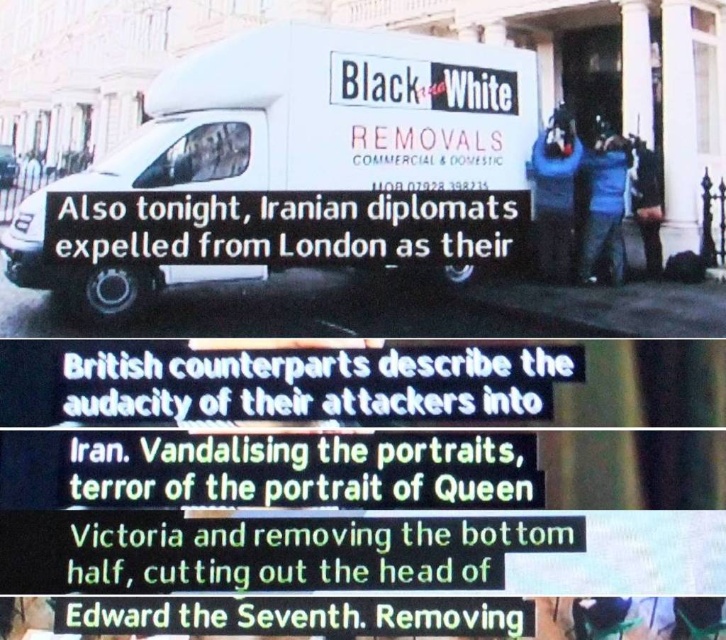
Is point (452, 74) behind point (600, 156)?

That is False.

Between point (486, 51) and point (582, 236), which one is positioned behind?

Positioned behind is point (486, 51).

Which is behind, point (224, 90) or point (600, 164)?

Positioned behind is point (600, 164).

Image resolution: width=726 pixels, height=640 pixels. I want to click on white matte van at center, so (x=295, y=138).

Can you confirm if blue fabric camera at upper right is taller than blue jeans at right?

Yes, blue fabric camera at upper right is taller than blue jeans at right.

Does blue fabric camera at upper right have a larger size compared to blue jeans at right?

Yes.

Who is more forward, (558, 115) or (621, 150)?

Point (558, 115)

The image size is (726, 640). In order to click on blue fabric camera at upper right in this screenshot , I will do `click(555, 193)`.

Who is higher up, white matte van at center or blue fabric camera at upper right?

blue fabric camera at upper right is above.

Who is more distant from viewer, [301,38] or [539,269]?

The point [539,269] is more distant.

Does point (460, 161) lie behind point (558, 275)?

Yes, point (460, 161) is behind point (558, 275).

Locate an element on the screen. white matte van at center is located at coordinates (295, 138).